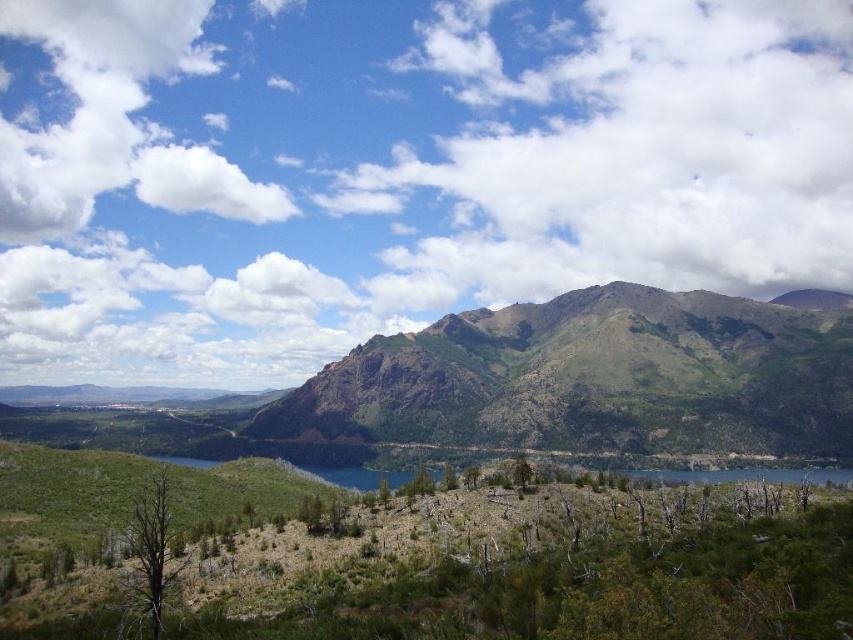
Question: Among these objects, which one is farthest from the camera?

Choices:
 (A) green grassy hillside at center
 (B) white fluffy cloud at upper center
 (C) green textured mountain at center
 (D) white fluffy cloud at upper left

Answer: (D)

Question: Does green grassy hillside at center have a lesser width compared to white fluffy cloud at upper left?

Choices:
 (A) yes
 (B) no

Answer: (A)

Question: Is green textured mountain at center to the left of white fluffy cloud at upper left from the viewer's perspective?

Choices:
 (A) no
 (B) yes

Answer: (A)

Question: Which object is closer to the camera taking this photo?

Choices:
 (A) green textured mountain at center
 (B) white fluffy cloud at upper center

Answer: (A)

Question: Can you confirm if white fluffy cloud at upper center is smaller than green grassy hillside at center?

Choices:
 (A) yes
 (B) no

Answer: (B)

Question: Which point is farther from the camera taking this photo?

Choices:
 (A) (376, 541)
 (B) (355, 332)
 (C) (635, 305)

Answer: (B)